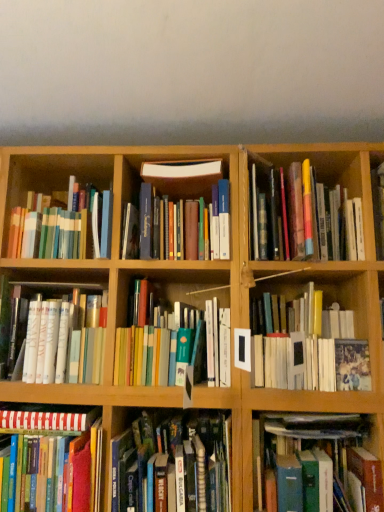
Question: Is white matte book at left, the second book viewed from the left, bigger or smaller than hardcover book at center right, which is the 2th book from right to left?

Choices:
 (A) big
 (B) small

Answer: (B)

Question: From the image's perspective, is white matte book at left, the second book viewed from the left, above or below hardcover book at center right, which is the eighth book from left to right?

Choices:
 (A) below
 (B) above

Answer: (A)

Question: Based on their relative distances, which object is nearer to the hardcover books at center, which is counted as the 6th book, starting from the right?

Choices:
 (A) multicolored hardcover books at upper left, the third book in the left-to-right sequence
 (B) hardcover books at upper right, placed as the 9th book when sorted from left to right
 (C) hardcover book at center right, which is the 2th book from right to left
 (D) white matte book at left, placed as the 8th book when sorted from right to left
 (E) striped paper book at lower left, arranged as the 1th book when viewed from the left

Answer: (E)

Question: Based on their relative distances, which object is farther from the white matte book at left, placed as the 8th book when sorted from right to left?

Choices:
 (A) multicolored hardcover books at upper left, the 7th book in the right-to-left sequence
 (B) hardcover book at lower right, positioned as the 3th book in right-to-left order
 (C) hardcover book at center, the fourth book viewed from the right
 (D) hardcover books at center, which is counted as the 6th book, starting from the right
 (E) hardcover books at center, the 5th book when ordered from left to right

Answer: (B)